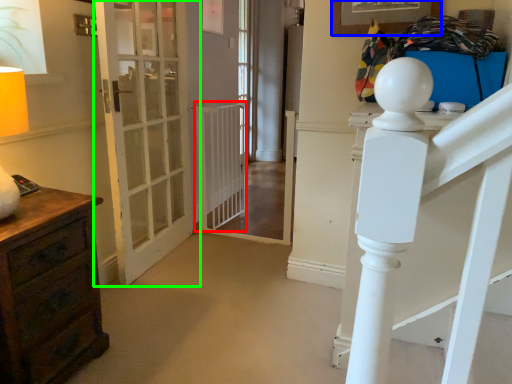
Question: Which object is positioned farthest from radiator (highlighted by a red box)? Select from picture frame (highlighted by a blue box) and door (highlighted by a green box).

Choices:
 (A) picture frame
 (B) door

Answer: (A)